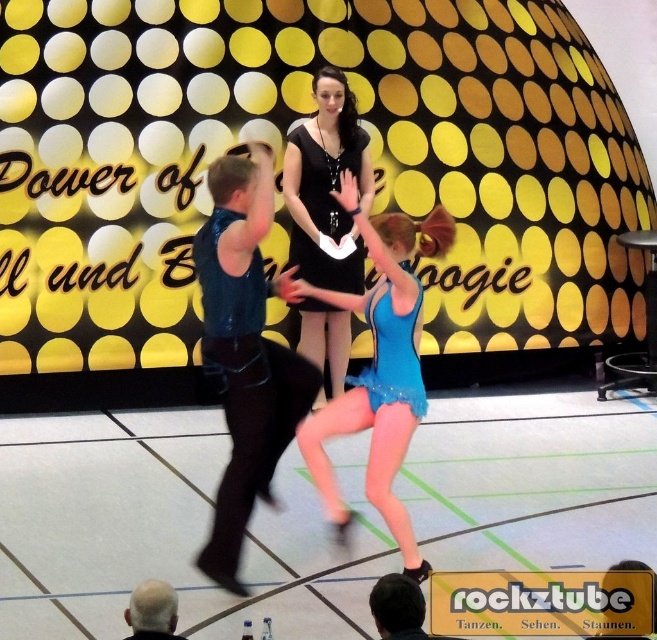
Question: Which of the following is the closest to the observer?

Choices:
 (A) black satin dress at center
 (B) gray hair at lower left
 (C) blue sequined dress at center
 (D) blue sequined leotard at center

Answer: (B)

Question: Does blue sequined leotard at center appear over blue sequined dress at center?

Choices:
 (A) yes
 (B) no

Answer: (B)

Question: Which of these objects is positioned farthest from the black satin dress at center?

Choices:
 (A) shiny blue vest at center
 (B) blue sequined dress at center
 (C) blue sequined leotard at center
 (D) gray hair at lower left

Answer: (D)

Question: Can you confirm if shiny blue vest at center is positioned to the left of black satin dress at center?

Choices:
 (A) yes
 (B) no

Answer: (A)

Question: Is shiny blue vest at center closer to the viewer compared to black satin dress at center?

Choices:
 (A) yes
 (B) no

Answer: (A)

Question: Among these points, which one is farthest from the camera?

Choices:
 (A) (340, 259)
 (B) (315, 394)

Answer: (A)